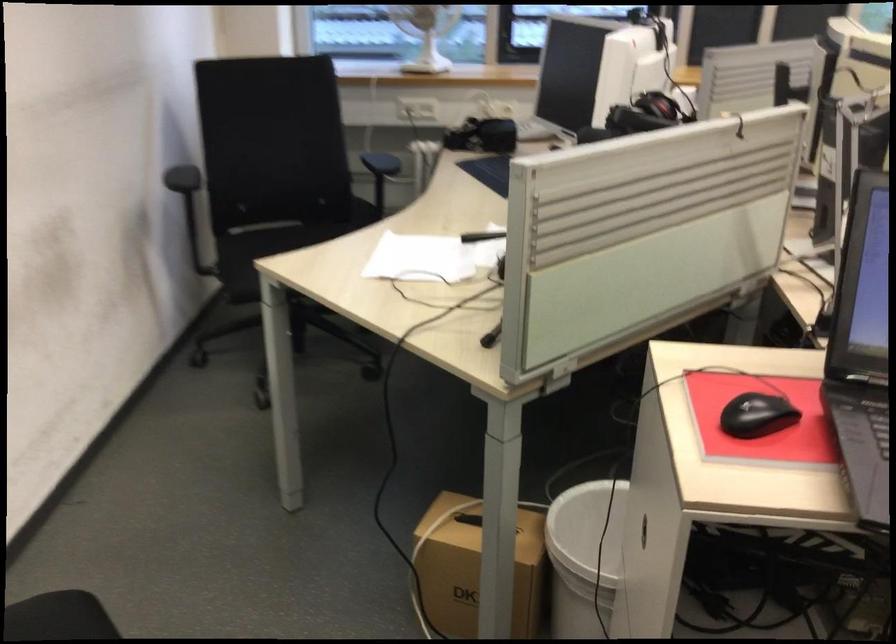
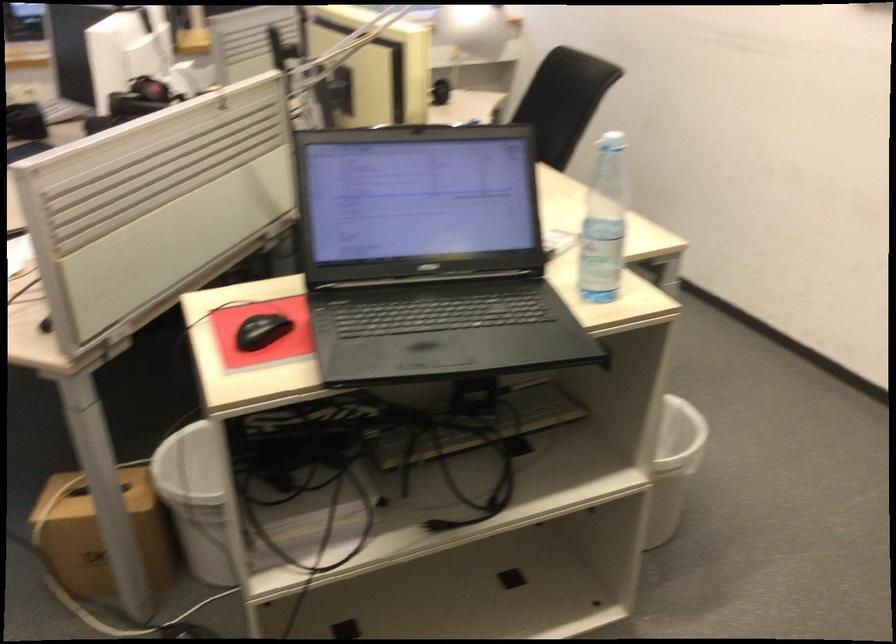
Locate, in the second image, the point that corresponds to the point at 762,413 in the first image.

(261, 330)